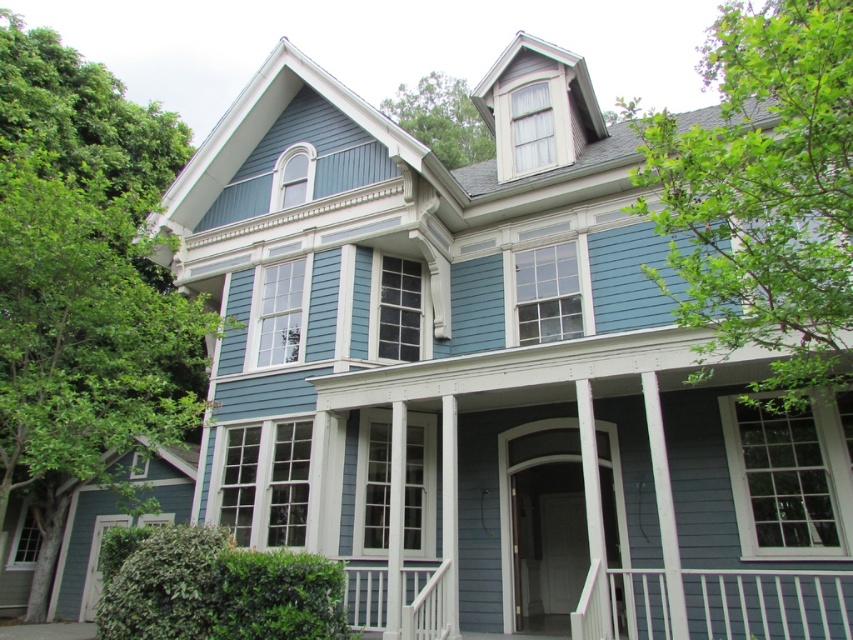
You are standing on the front porch of the two story house and looking towards the trees. Which tree, the green leafy tree at upper right or the green leafy tree at upper center, appears closer to you?

The green leafy tree at upper right appears closer because it is in front of the green leafy tree at upper center, partially obscuring it from view.

Based on the scene of the two green leafy trees in the image, which one is taller between the green leafy tree at upper right and the green leafy tree at upper center?

The green leafy tree at upper right is much taller than the green leafy tree at upper center.